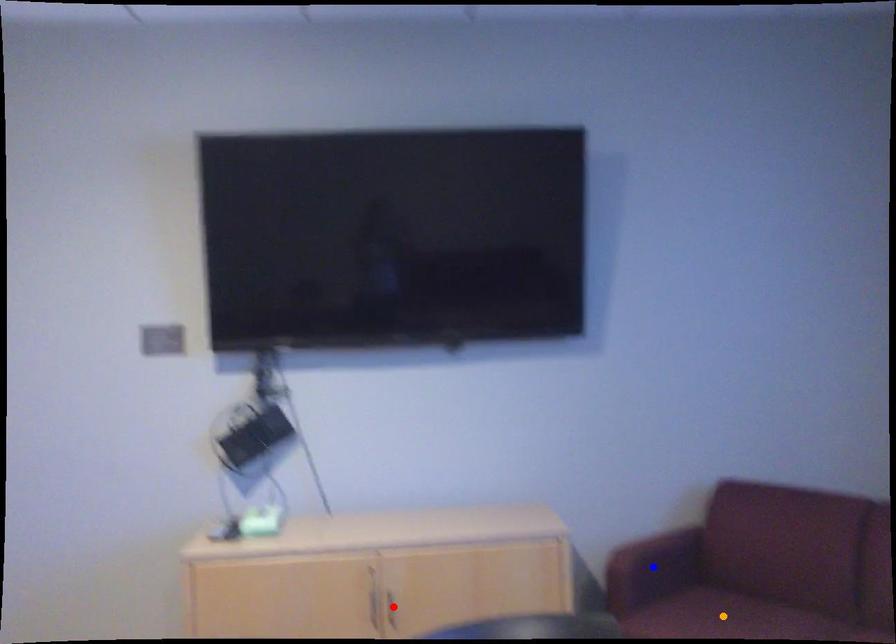
Order these from farthest to nearest:
A) blue point
B) red point
C) orange point

blue point < red point < orange point